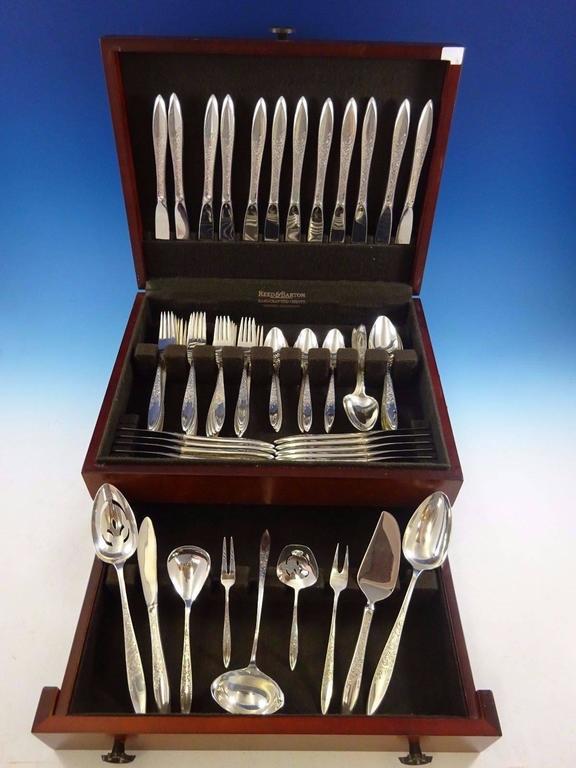
Where is `silver cutlery on bottom shelf`? The width and height of the screenshot is (576, 768). silver cutlery on bottom shelf is located at coordinates (111, 541), (154, 560), (185, 571), (223, 578), (241, 707), (294, 617), (337, 578), (386, 561), (420, 541).